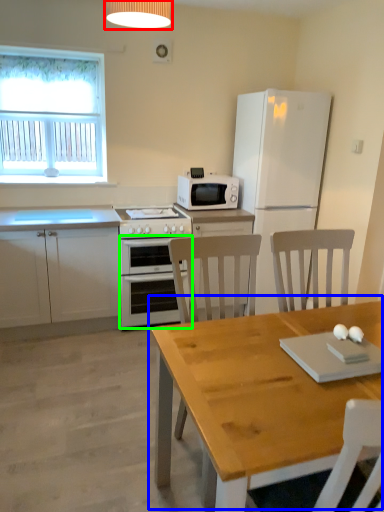
Question: Which object is positioned closest to lamp (highlighted by a red box)? Select from table (highlighted by a blue box) and oven (highlighted by a green box).

Choices:
 (A) table
 (B) oven

Answer: (B)